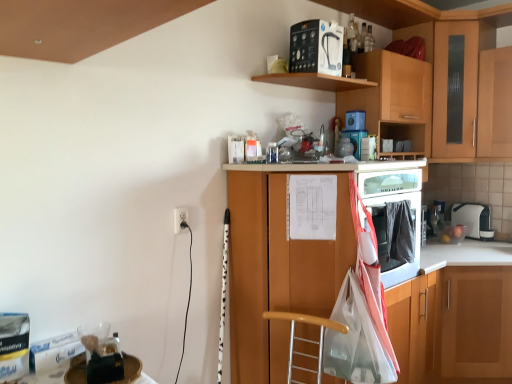
Question: In the image, is wooden cabinet at upper right, marked as the third cabinetry in a right-to-left arrangement, on the left side or the right side of white matte water filter at upper center, the first appliance in the top-to-bottom sequence?

Choices:
 (A) right
 (B) left

Answer: (A)

Question: From the image's perspective, relative to white matte water filter at upper center, the first appliance in the left-to-right sequence, is wooden cabinet at upper right, the 2th cabinetry in the left-to-right sequence, above or below?

Choices:
 (A) below
 (B) above

Answer: (A)

Question: Which is farther from the wooden shelf at upper center?

Choices:
 (A) blue plastic container at upper center, which ranks as the 2th appliance in back-to-front order
 (B) white matte water filter at upper center, which appears as the 4th appliance when ordered from the bottom
 (C) white plastic electric outlet at lower left
 (D) white plastic toaster at upper right, positioned as the 4th appliance in left-to-right order
 (E) white glossy counter at lower right

Answer: (D)

Question: Which is farther from the white plastic toaster at upper right, which appears as the first appliance when viewed from the right?

Choices:
 (A) blue glossy coffee maker at upper center, arranged as the 2th appliance when viewed from the front
 (B) wooden cabinet at upper right, the 1th cabinetry when ordered from right to left
 (C) wooden cabinet at center, the fourth cabinetry in the right-to-left sequence
 (D) white plastic electric outlet at lower left
 (E) blue plastic container at upper center, the 2th appliance in the left-to-right sequence

Answer: (D)